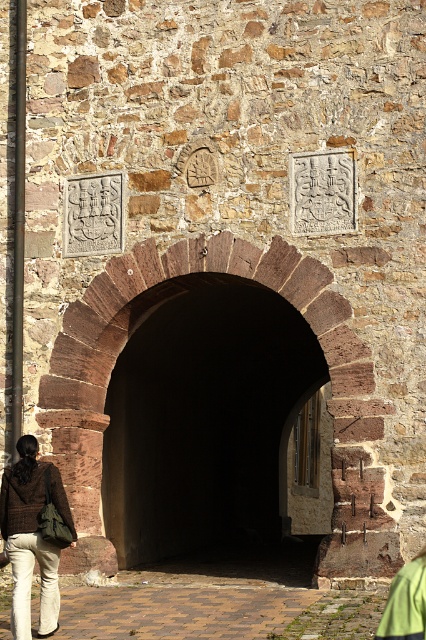
Where is the dark stone tunnel at center located in the image?

The dark stone tunnel at center is located at point (x=203, y=420).

You are standing in front of the stone wall with the arched doorway. You need to determine if a ladder that is 1.8 meters tall can fit vertically inside the dark stone tunnel at center. Based on the height of the tunnel compared to the brick pavement at lower center, can the ladder fit?

The dark stone tunnel at center has a greater height than the brick pavement at lower center. Since the ladder is 1.8 meters tall, and the tunnel is taller than the pavement, it is possible that the ladder can fit vertically inside the tunnel. However, without knowing the exact height of the tunnel, we cannot confirm with certainty.

You are standing in front of the stone wall with the arched doorway. There is a brick pavement at lower center marked by point [178,611]. Can you determine if this point is closer to the arched doorway or the upper part of the wall?

The brick pavement at lower center is represented by point [178,611], so it is closer to the arched doorway than the upper part of the wall.